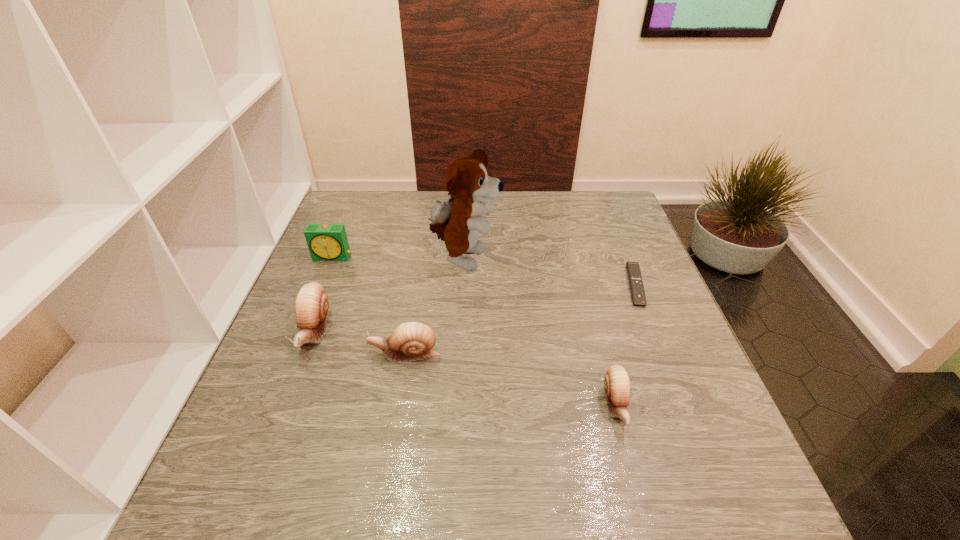
Locate an element on the screen. vacant region that satisfies the following two spatial constraints: 1. on the face of the remote control; 2. on the right side of the tallest object is located at coordinates (464, 286).

Locate an element on the screen. This screenshot has width=960, height=540. free space that satisfies the following two spatial constraints: 1. on the face of the puppy; 2. on the left side of the rightmost object is located at coordinates (464, 286).

Locate an element on the screen. vacant space that satisfies the following two spatial constraints: 1. on the face of the tallest object; 2. on the front-facing side of the leftmost escargot is located at coordinates (462, 332).

Find the location of a particular element. This screenshot has height=540, width=960. vacant region that satisfies the following two spatial constraints: 1. on the front-facing side of the rightmost object; 2. on the right side of the alarm clock is located at coordinates (321, 286).